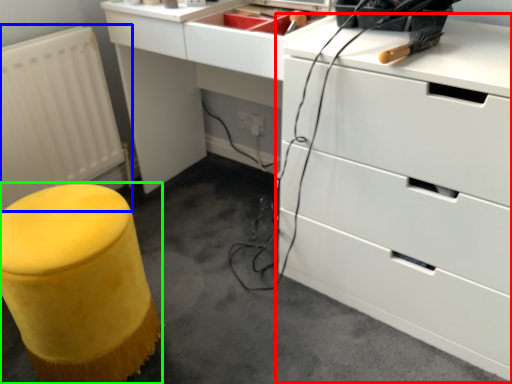
Question: Considering the real-world distances, which object is farthest from chest of drawers (highlighted by a red box)? radiator (highlighted by a blue box) or furniture (highlighted by a green box)?

Choices:
 (A) radiator
 (B) furniture

Answer: (A)